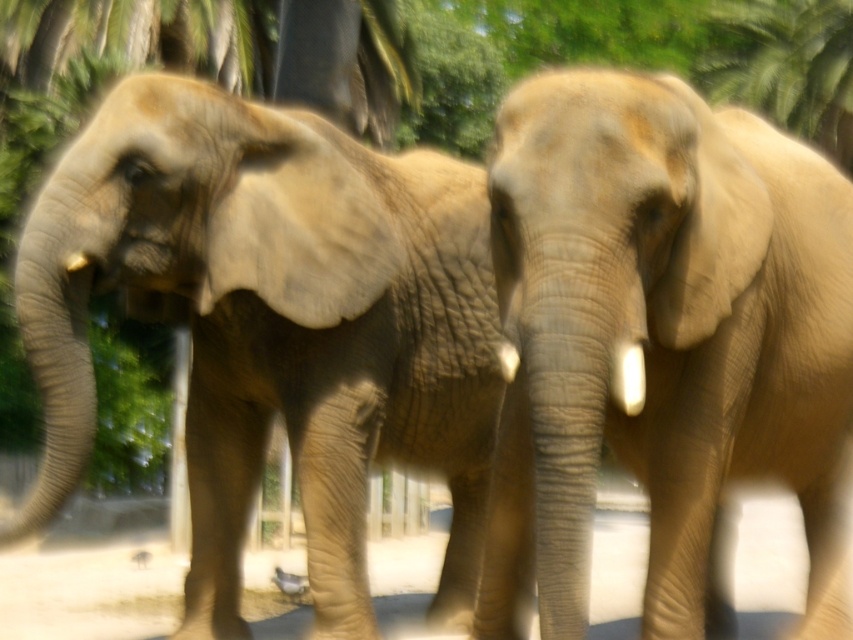
You are a zookeeper who needs to fit both the gray textured elephant at center and the smooth beige elephant at center into a transport vehicle. The vehicle can only accommodate one elephant at a time. Which elephant would you choose to transport first if you want to ensure the larger one gets enough space?

The gray textured elephant at center is larger than the smooth beige elephant at center, so you should transport the gray textured elephant at center first to ensure it has enough space in the vehicle.

You are a photographer trying to capture a clear shot of the gray textured elephant at center without the wooden fence at lower center blocking the view. Based on their positions, can you position yourself in a way to avoid the fence?

The gray textured elephant at center is positioned over the wooden fence at lower center, so moving your camera angle slightly upwards would allow you to capture the elephant without the fence obstructing the view.

You are a zookeeper observing two elephants in their enclosure. You notice the gray textured elephant at center and the smooth beige elephant at center. Which elephant is positioned lower in the image?

The gray textured elephant at center is positioned lower than the smooth beige elephant at center.